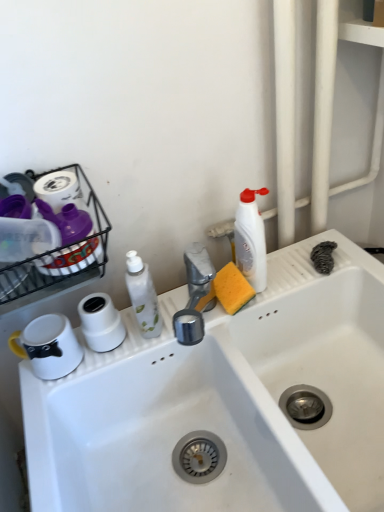
This screenshot has width=384, height=512. Find the location of `vacant area that lies to the right of white plastic bottle at upper right, which is the second cleaning product in left-to-right order`. vacant area that lies to the right of white plastic bottle at upper right, which is the second cleaning product in left-to-right order is located at coordinates (309, 265).